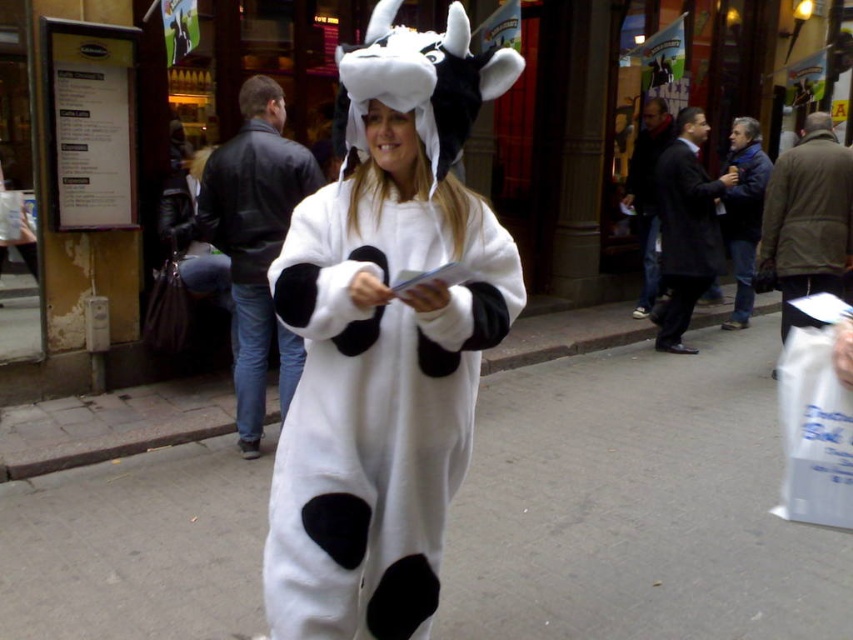
Question: Can you confirm if white fuzzy onesie at center is wider than white paper bag at lower right?

Choices:
 (A) yes
 (B) no

Answer: (B)

Question: Based on their relative distances, which object is nearer to the matte black coat at center?

Choices:
 (A) white smooth pavement at center
 (B) white paper bag at lower right

Answer: (B)

Question: Is white smooth pavement at center thinner than white paper bag at lower right?

Choices:
 (A) no
 (B) yes

Answer: (A)

Question: Which is nearer to the matte black coat at center?

Choices:
 (A) white paper bag at lower right
 (B) white smooth pavement at center

Answer: (A)

Question: Which point is farther to the camera?

Choices:
 (A) (376, 605)
 (B) (669, 291)
 (C) (241, 616)

Answer: (B)

Question: Does white smooth pavement at center have a smaller size compared to white fuzzy onesie at center?

Choices:
 (A) no
 (B) yes

Answer: (A)